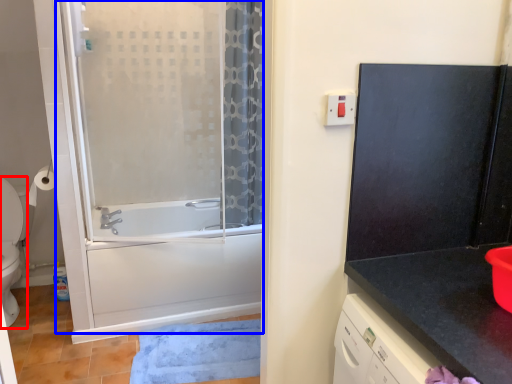
Question: Which point is closer to the camera, toilet (highlighted by a red box) or screen door (highlighted by a blue box)?

Choices:
 (A) toilet
 (B) screen door

Answer: (B)